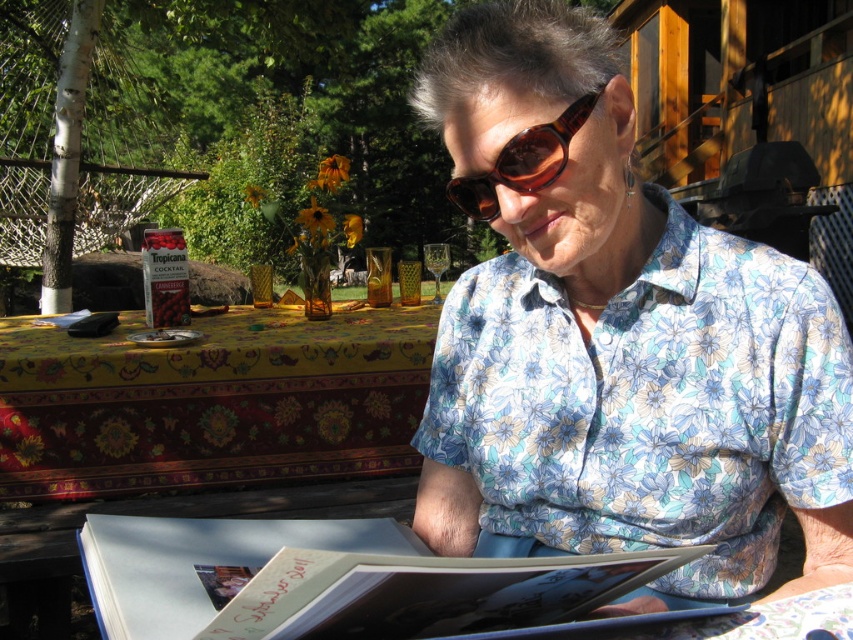
You are a photographer trying to capture the scene of the woman with the photo album. You want to ensure the yellow floral fabric at upper left and the brown tortoiseshell sunglasses at center are both in the frame. Based on their positions, which object should you place closer to the left side of your camera viewfinder?

The yellow floral fabric at upper left should be placed closer to the left side of the camera viewfinder since it is positioned to the left of the brown tortoiseshell sunglasses at center.